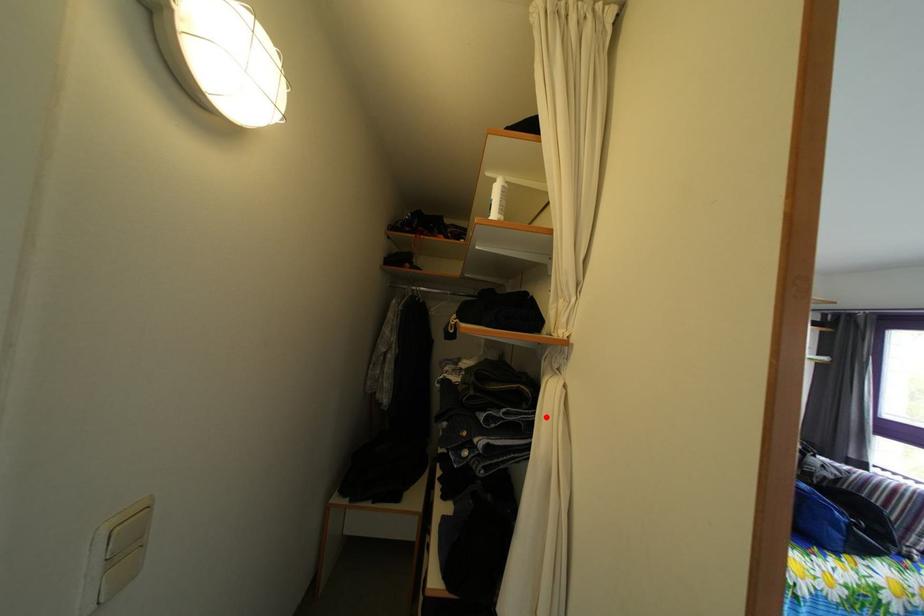
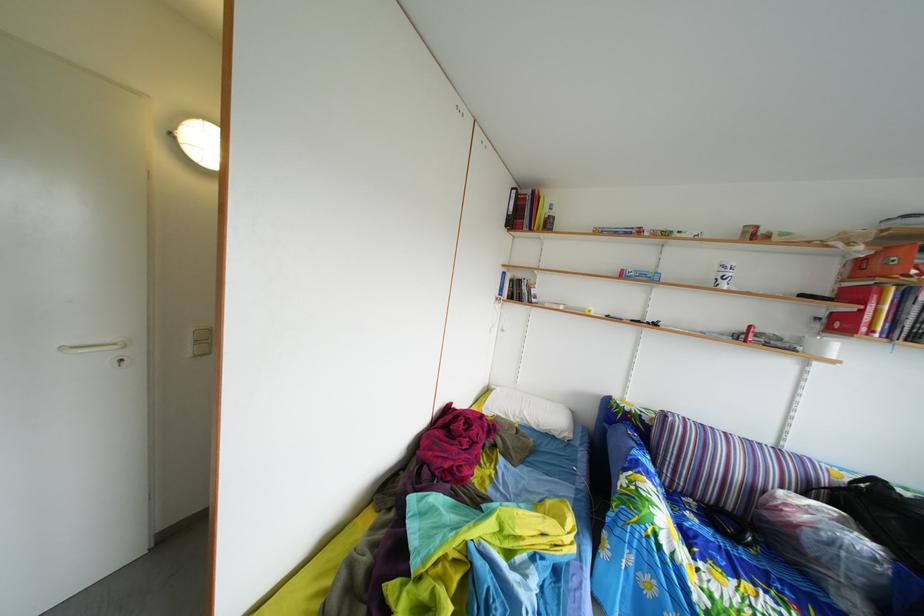
Question: I am providing you with two images of the same scene from different viewpoints. A red point is marked on the first image. Can you still see the location of the red point in image 2?

Choices:
 (A) Yes
 (B) No

Answer: (B)